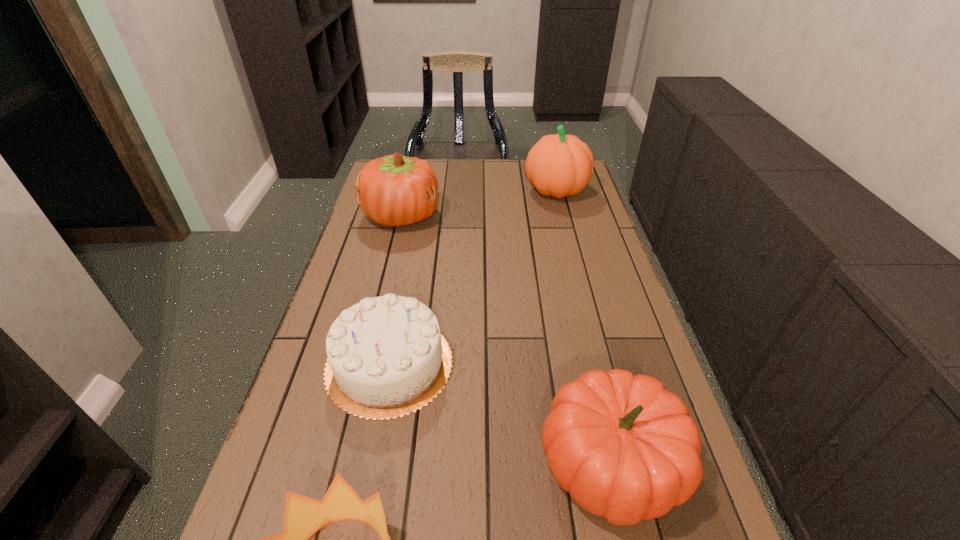
In order to click on vacant space at the far edge in this screenshot , I will do `click(462, 175)`.

Where is `free space at the left edge of the desktop`? The width and height of the screenshot is (960, 540). free space at the left edge of the desktop is located at coordinates (257, 504).

Locate an element on the screen. Image resolution: width=960 pixels, height=540 pixels. vacant space at the right edge is located at coordinates (578, 264).

Locate an element on the screen. This screenshot has height=540, width=960. vacant area between the leftmost pumpkin and the birthday cake is located at coordinates (396, 289).

The width and height of the screenshot is (960, 540). Identify the location of empty location between the nearest pumpkin and the birthday cake. (500, 414).

You are a GUI agent. You are given a task and a screenshot of the screen. Output one action in this format:
    pyautogui.click(x=<x>, y=<y>)
    Task: Click on the free space between the shortest pumpkin and the leftmost pumpkin
    
    Given the screenshot: What is the action you would take?
    pyautogui.click(x=506, y=340)

Image resolution: width=960 pixels, height=540 pixels. I want to click on empty space that is in between the shortest pumpkin and the leftmost pumpkin, so click(506, 340).

Identify which object is the fourth nearest to the birthday cake. Please provide its 2D coordinates. Your answer should be formatted as a tuple, i.e. [(x, y)], where the tuple contains the x and y coordinates of a point satisfying the conditions above.

[(559, 165)]

Locate which object ranks in proximity to the nearest pumpkin. Please provide its 2D coordinates. Your answer should be formatted as a tuple, i.e. [(x, y)], where the tuple contains the x and y coordinates of a point satisfying the conditions above.

[(387, 358)]

Locate an element on the screen. Image resolution: width=960 pixels, height=540 pixels. pumpkin object that ranks as the second closest to the leftmost pumpkin is located at coordinates (625, 448).